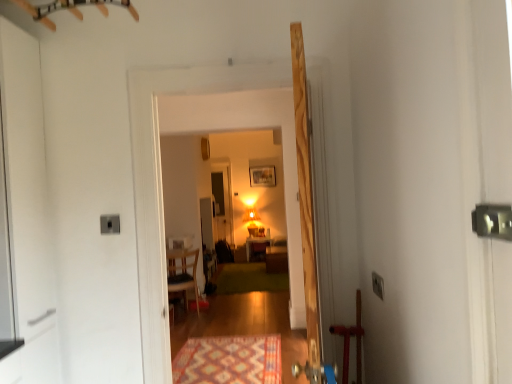
Question: Is multicolored woven mat at lower center, which appears as the 2th mat when viewed from the back, taller than wooden floor at center?

Choices:
 (A) no
 (B) yes

Answer: (A)

Question: Can you confirm if multicolored woven mat at lower center, which appears as the 2th mat when viewed from the back, is shorter than wooden floor at center?

Choices:
 (A) yes
 (B) no

Answer: (A)

Question: Considering the relative positions of multicolored woven mat at lower center, which ranks as the 1th mat in front-to-back order, and wooden floor at center in the image provided, is multicolored woven mat at lower center, which ranks as the 1th mat in front-to-back order, to the right of wooden floor at center from the viewer's perspective?

Choices:
 (A) no
 (B) yes

Answer: (A)

Question: From a real-world perspective, is multicolored woven mat at lower center, which appears as the 2th mat when viewed from the back, positioned under wooden floor at center based on gravity?

Choices:
 (A) no
 (B) yes

Answer: (B)

Question: Considering the relative sizes of multicolored woven mat at lower center, which ranks as the 1th mat in front-to-back order, and wooden floor at center in the image provided, is multicolored woven mat at lower center, which ranks as the 1th mat in front-to-back order, bigger than wooden floor at center?

Choices:
 (A) no
 (B) yes

Answer: (A)

Question: Is multicolored woven mat at lower center, which ranks as the 1th mat in front-to-back order, next to wooden floor at center and touching it?

Choices:
 (A) yes
 (B) no

Answer: (B)

Question: From the image's perspective, is multicolored woven mat at lower center, which ranks as the 1th mat in front-to-back order, located beneath wooden armchair at center?

Choices:
 (A) no
 (B) yes

Answer: (B)

Question: Can you confirm if multicolored woven mat at lower center, which ranks as the 1th mat in front-to-back order, is shorter than wooden armchair at center?

Choices:
 (A) yes
 (B) no

Answer: (A)

Question: From the image's perspective, is multicolored woven mat at lower center, which appears as the 2th mat when viewed from the back, over wooden armchair at center?

Choices:
 (A) no
 (B) yes

Answer: (A)

Question: From a real-world perspective, is multicolored woven mat at lower center, which appears as the 2th mat when viewed from the back, below wooden armchair at center?

Choices:
 (A) no
 (B) yes

Answer: (B)

Question: Is multicolored woven mat at lower center, which ranks as the 1th mat in front-to-back order, positioned beyond the bounds of wooden armchair at center?

Choices:
 (A) yes
 (B) no

Answer: (A)

Question: Is wooden armchair at center at the back of multicolored woven mat at lower center, which ranks as the 1th mat in front-to-back order?

Choices:
 (A) no
 (B) yes

Answer: (A)

Question: Is green carpet at center, positioned as the 2th mat in front-to-back order, far away from wooden door at center?

Choices:
 (A) no
 (B) yes

Answer: (B)